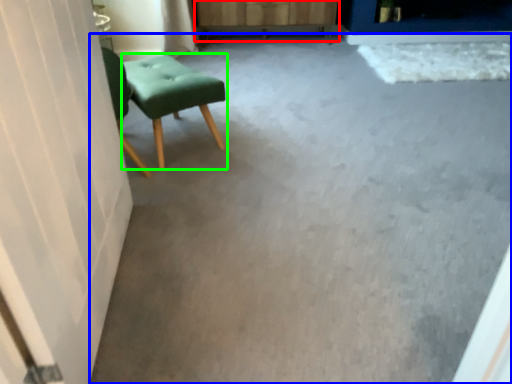
Question: Based on their relative distances, which object is farther from dresser (highlighted by a red box)? Choose from concrete (highlighted by a blue box) and stool (highlighted by a green box).

Choices:
 (A) concrete
 (B) stool

Answer: (A)